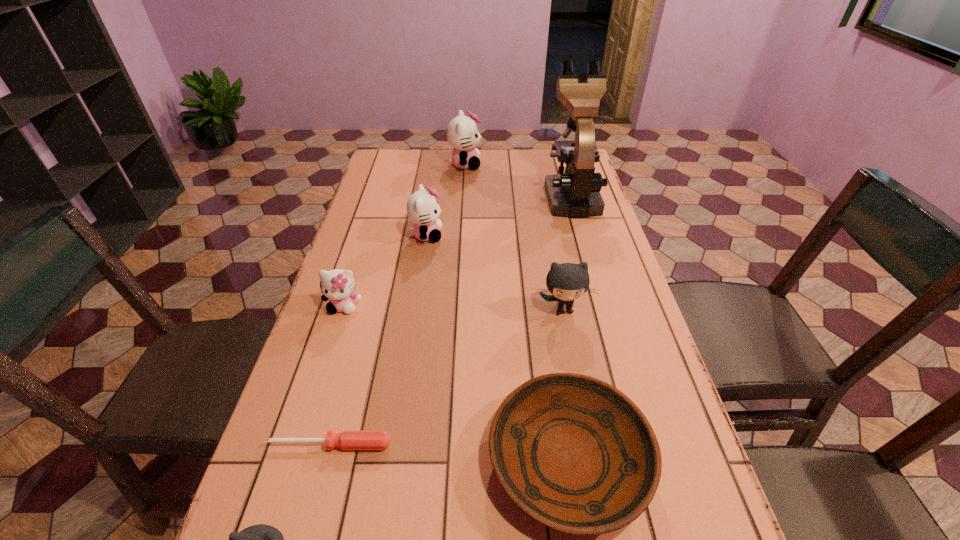
Image resolution: width=960 pixels, height=540 pixels. I want to click on the tallest object, so click(575, 193).

The height and width of the screenshot is (540, 960). In order to click on the farthest white kitten in this screenshot , I will do pyautogui.click(x=462, y=133).

Find the location of a particular element. the farthest kitten is located at coordinates (462, 133).

The image size is (960, 540). Find the location of `the fourth nearest kitten`. the fourth nearest kitten is located at coordinates (422, 207).

This screenshot has height=540, width=960. I want to click on the third farthest object, so pos(422,207).

In order to click on the right gray kitten in this screenshot , I will do point(567,281).

You are a GUI agent. You are given a task and a screenshot of the screen. Output one action in this format:
    pyautogui.click(x=<x>, y=<y>)
    Task: Click on the rightmost kitten
    This screenshot has height=540, width=960.
    Given the screenshot: What is the action you would take?
    pyautogui.click(x=567, y=281)

Find the location of a particular element. The image size is (960, 540). the smallest white kitten is located at coordinates (337, 285).

Find the location of a particular element. This screenshot has width=960, height=540. the nearest white kitten is located at coordinates (337, 285).

The height and width of the screenshot is (540, 960). I want to click on red screwdriver, so [x=349, y=439].